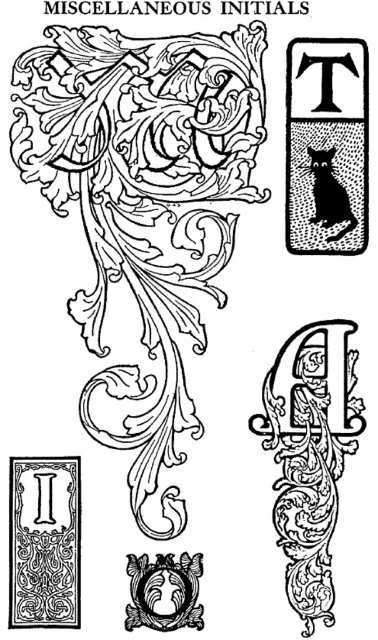
Question: Which point is closer to the camera?

Choices:
 (A) (331, 452)
 (B) (150, 627)

Answer: (B)

Question: Where is matte black ornate letter a at center located in relation to black ornate letter at lower left in the image?

Choices:
 (A) left
 (B) right

Answer: (B)

Question: Which is nearer to the black ink swirls at upper left?

Choices:
 (A) black dotted cat at upper right
 (B) black ornate letter at lower left

Answer: (A)

Question: Is black ink swirls at upper left positioned in front of matte gold ornate emblem at center?

Choices:
 (A) no
 (B) yes

Answer: (A)

Question: Can you confirm if black dotted cat at upper right is smaller than black ornate letter at lower left?

Choices:
 (A) yes
 (B) no

Answer: (B)

Question: Which object is farther from the camera taking this photo?

Choices:
 (A) matte black ornate letter a at center
 (B) black ink swirls at upper left
 (C) black dotted cat at upper right

Answer: (C)